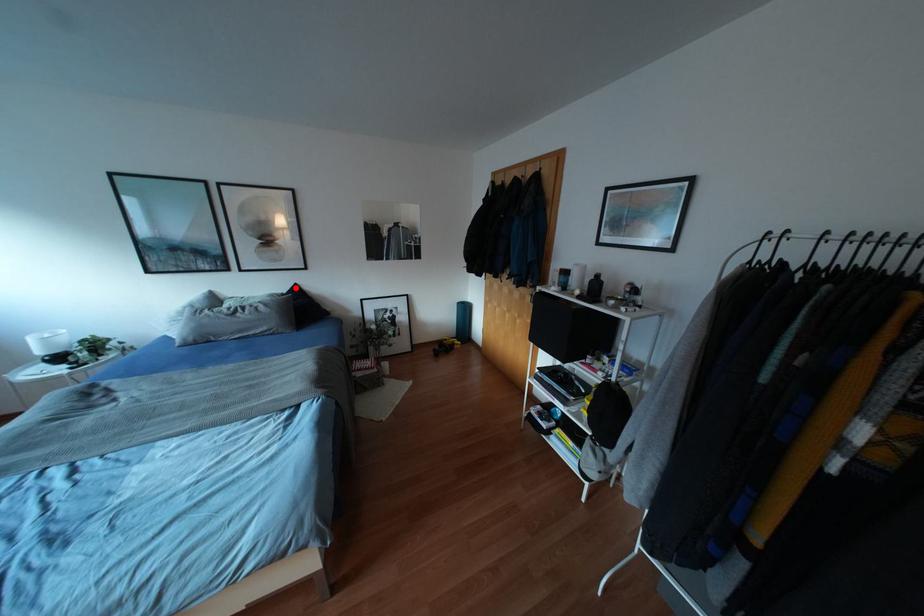
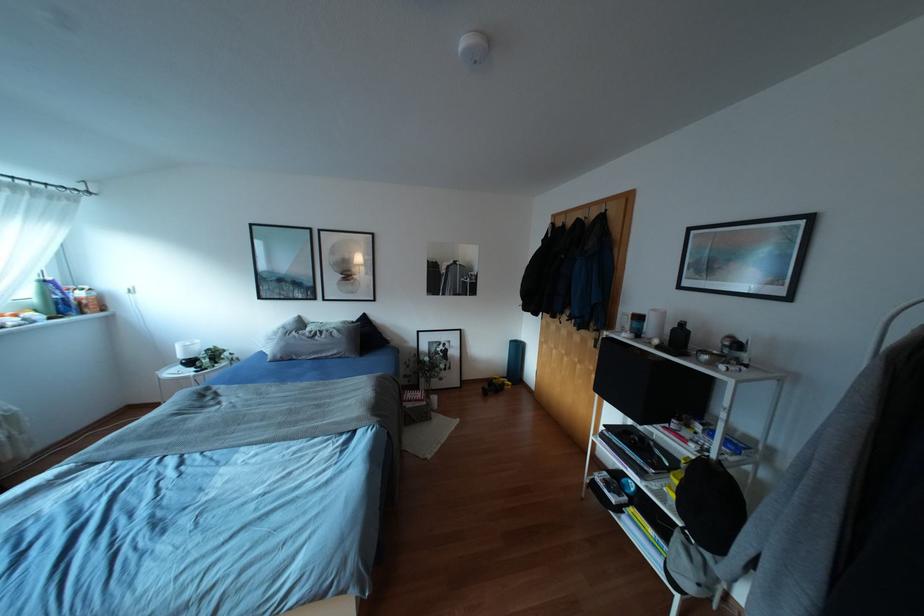
Question: I am providing you with two images of the same scene from different viewpoints. A red point is marked on the first image. Can you still see the location of the red point in image 2?

Choices:
 (A) Yes
 (B) No

Answer: (A)